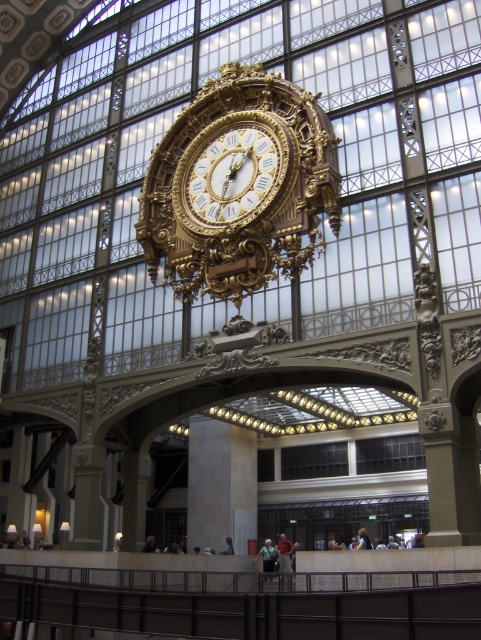
Does point (231, 163) lie behind point (205, 538)?

No.

Is gold/gilded metal clock at center bigger than smooth concrete pillar at center?

Yes.

The height and width of the screenshot is (640, 481). What are the coordinates of `gold/gilded metal clock at center` in the screenshot? It's located at (233, 173).

Locate an element on the screen. The image size is (481, 640). gold/gilded metal clock at center is located at coordinates (233, 173).

Is gold ornate clock at center to the left of gold/gilded metal clock at center from the viewer's perspective?

Incorrect, gold ornate clock at center is not on the left side of gold/gilded metal clock at center.

Does gold ornate clock at center have a lesser height compared to gold/gilded metal clock at center?

In fact, gold ornate clock at center may be taller than gold/gilded metal clock at center.

The width and height of the screenshot is (481, 640). I want to click on gold ornate clock at center, so click(x=239, y=186).

Between point (270, 268) and point (200, 444), which one is positioned behind?

Point (200, 444)

Is gold ornate clock at center taller than smooth concrete pillar at center?

Yes.

Does point (251, 76) come farther from viewer compared to point (235, 529)?

No, it is not.

What are the coordinates of `gold ornate clock at center` in the screenshot? It's located at (239, 186).